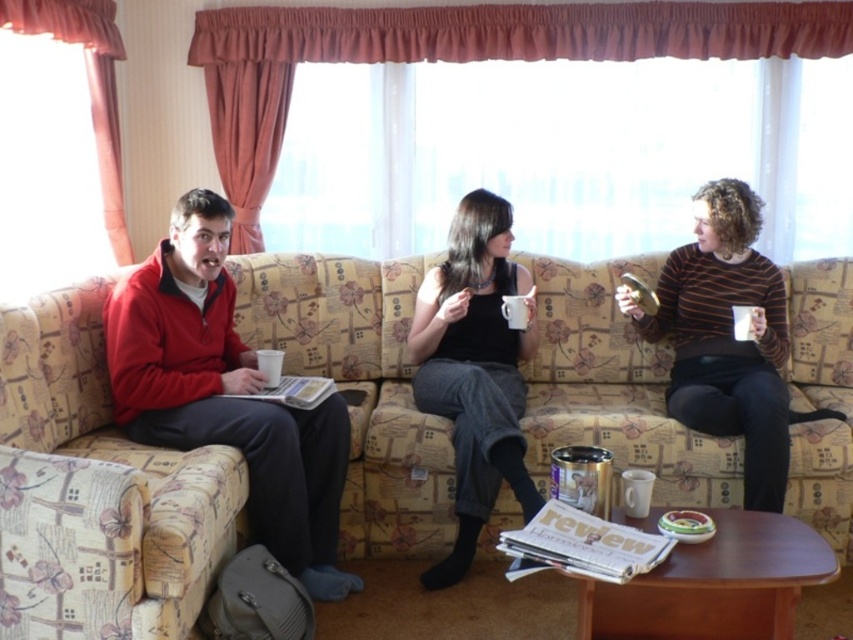
In the scene shown: You are arranging a small potted plant on the beige floral fabric couch at center. To ensure it doesn not fall off, where should you place it relative to the striped sweater at right?

The beige floral fabric couch at center is positioned under the striped sweater at right, so placing the potted plant on the couch near the edge closest to the striped sweater at right would keep it stable and prevent it from falling off.

You are a photographer taking a photo of the people on the sofa. You want to ensure that both the matte red sweater at left and the matte black tank top at center are clearly visible in the frame. Based on their positions, which one might be partially hidden if you focus on the lower part of the sofa?

The matte red sweater at left is below the matte black tank top at center, so focusing on the lower part of the sofa might partially hide the matte red sweater at left.

You are a guest entering the living room and want to sit on the striped sweater at right. Can you directly sit there without moving the beige floral fabric couch at center?

The striped sweater at right is behind the beige floral fabric couch at center, so you cannot directly sit on the striped sweater at right without moving the couch first.